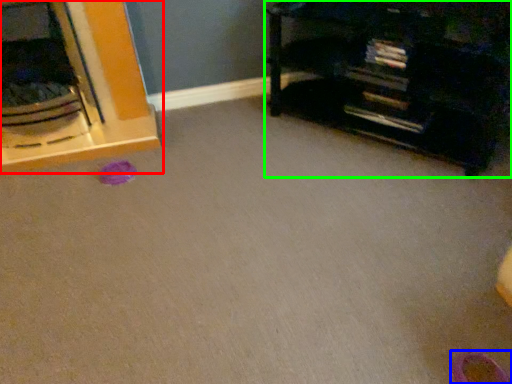
Question: Which object is the closest to the furniture (highlighted by a red box)? Choose among these: shoe (highlighted by a blue box) or furniture (highlighted by a green box).

Choices:
 (A) shoe
 (B) furniture

Answer: (B)